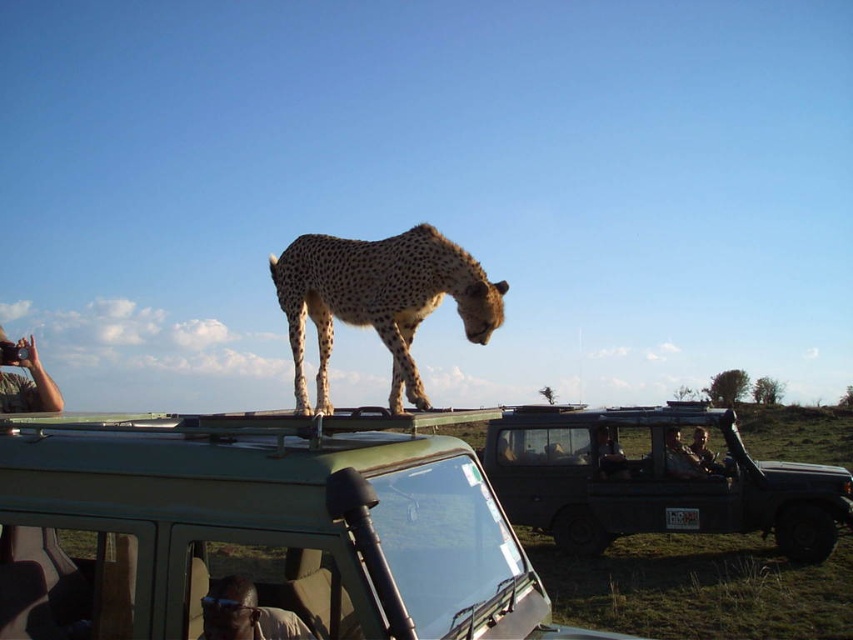
Question: Which object is positioned closest to the matte green suv at center?

Choices:
 (A) smooth skin face at center
 (B) camouflage fabric camera at upper left

Answer: (A)

Question: Can you confirm if green matte vehicle at center is positioned to the right of camouflage fabric camera at upper left?

Choices:
 (A) yes
 (B) no

Answer: (A)

Question: Does matte green suv at center have a lesser width compared to camouflage fabric camera at upper left?

Choices:
 (A) yes
 (B) no

Answer: (B)

Question: Does green matte vehicle at center appear on the right side of leather jacket at center?

Choices:
 (A) no
 (B) yes

Answer: (A)

Question: Which is farther from the green matte vehicle at center?

Choices:
 (A) matte green suv at center
 (B) dark skin textured face at lower center
 (C) camouflage fabric camera at upper left

Answer: (A)

Question: Which object is the closest to the spotted fur cheetah at center?

Choices:
 (A) matte green suv at center
 (B) leather jacket at center
 (C) smooth skin face at center

Answer: (A)